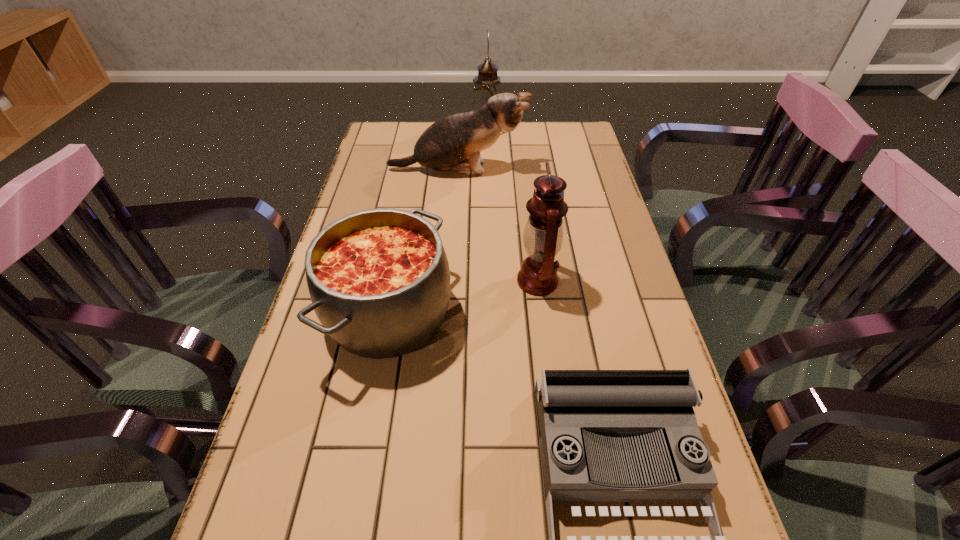
The width and height of the screenshot is (960, 540). I want to click on the left oil lamp, so click(x=487, y=84).

Image resolution: width=960 pixels, height=540 pixels. In order to click on the farther oil lamp in this screenshot , I will do `click(487, 84)`.

Identify the location of the nearer oil lamp. (543, 235).

Image resolution: width=960 pixels, height=540 pixels. Find the location of `the second farthest object`. the second farthest object is located at coordinates (453, 143).

This screenshot has height=540, width=960. In order to click on cat in this screenshot , I will do `click(453, 143)`.

I want to click on the fourth tallest object, so click(x=379, y=280).

This screenshot has height=540, width=960. I want to click on vacant space located 0.090m on the left of the farthest object, so click(448, 130).

Where is `vacant space located on the back of the right oil lamp`? This screenshot has height=540, width=960. vacant space located on the back of the right oil lamp is located at coordinates (528, 203).

In order to click on vacant region located at the face of the cat in this screenshot , I will do `click(548, 170)`.

At what (x,y) coordinates should I click in order to perform the action: click on vacant space located on the back of the casserole. Please return your answer as a coordinate pair (x, y). Looking at the image, I should click on (x=402, y=242).